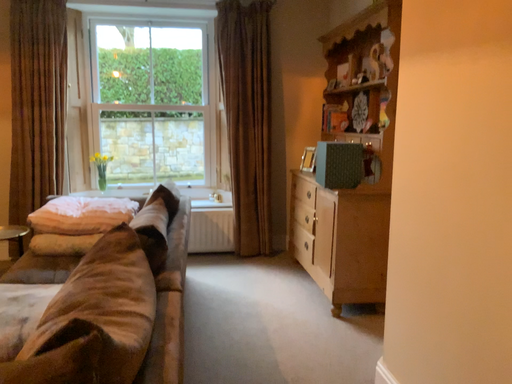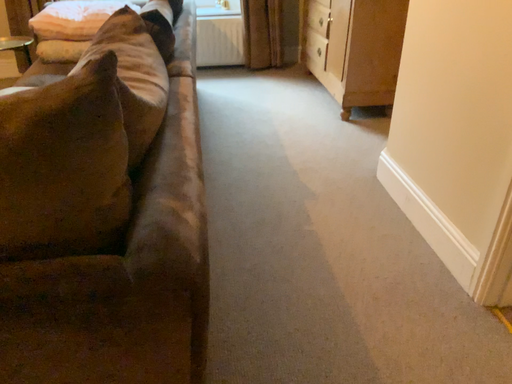
Question: Which way did the camera rotate in the video?

Choices:
 (A) rotated downward
 (B) rotated upward

Answer: (A)